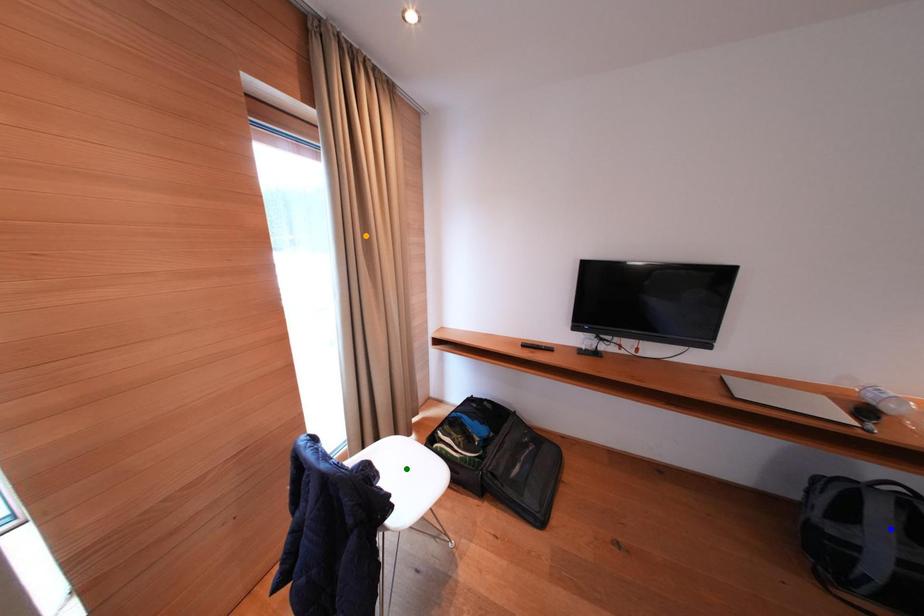
Based on the photo, order these from farthest to nearest:
A) blue point
B) orange point
C) green point

1. green point
2. orange point
3. blue point